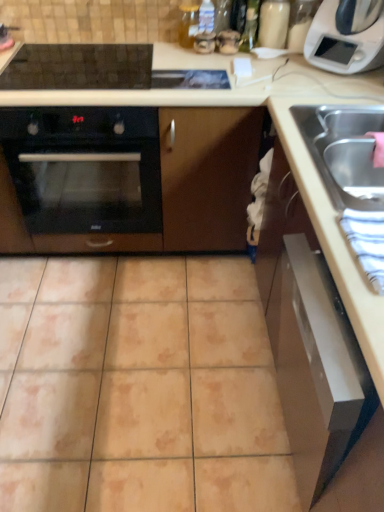
What do you see at coordinates (309, 339) in the screenshot? The width and height of the screenshot is (384, 512). I see `satin silver drawer at lower right` at bounding box center [309, 339].

Image resolution: width=384 pixels, height=512 pixels. I want to click on white plastic microwave at upper right, so click(344, 40).

Describe the element at coordinates (344, 152) in the screenshot. The width and height of the screenshot is (384, 512). I see `stainless steel sink at right` at that location.

Measure the distance between beige ceramic tile at center and camera.

A distance of 1.32 meters exists between beige ceramic tile at center and camera.

Describe the element at coordinates (87, 185) in the screenshot. Image resolution: width=384 pixels, height=512 pixels. I see `black glass oven at left` at that location.

Find the location of a particular element. Image resolution: width=384 pixels, height=512 pixels. satin silver drawer at lower right is located at coordinates (309, 339).

Which of these two, stainless steel sink at right or beige ceramic tile at center, stands shorter?

Standing shorter between the two is beige ceramic tile at center.

Looking at their sizes, would you say stainless steel sink at right is wider or thinner than beige ceramic tile at center?

Considering their sizes, stainless steel sink at right looks slimmer than beige ceramic tile at center.

Consider the image. Is stainless steel sink at right oriented towards beige ceramic tile at center?

No, stainless steel sink at right is not turned towards beige ceramic tile at center.

Measure the distance between stainless steel sink at right and beige ceramic tile at center.

The distance of stainless steel sink at right from beige ceramic tile at center is 38.70 inches.

From a real-world perspective, who is located lower, satin silver drawer at lower right or stainless steel sink at right?

satin silver drawer at lower right, from a real-world perspective.

Can you confirm if satin silver drawer at lower right is thinner than stainless steel sink at right?

In fact, satin silver drawer at lower right might be wider than stainless steel sink at right.

Would you say satin silver drawer at lower right contains stainless steel sink at right?

No, stainless steel sink at right is not a part of satin silver drawer at lower right.

Based on the photo, which is behind, white plastic microwave at upper right or stainless steel sink at right?

white plastic microwave at upper right.

Is stainless steel sink at right a part of white plastic microwave at upper right?

No, stainless steel sink at right is not surrounded by white plastic microwave at upper right.

Is white plastic microwave at upper right positioned with its back to stainless steel sink at right?

That's not correct — white plastic microwave at upper right is not looking away from stainless steel sink at right.

Which of these two, white plastic microwave at upper right or stainless steel sink at right, stands shorter?

Standing shorter between the two is stainless steel sink at right.

Are satin silver drawer at lower right and black glass oven at left far apart?

No, there isn't a large distance between satin silver drawer at lower right and black glass oven at left.

Identify the location of oven behind the satin silver drawer at lower right. The width and height of the screenshot is (384, 512). (87, 185).

From the image's perspective, is satin silver drawer at lower right over black glass oven at left?

No, from the image's perspective, satin silver drawer at lower right is not on top of black glass oven at left.

From a real-world perspective, between white plastic microwave at upper right and satin silver drawer at lower right, who is vertically higher?

white plastic microwave at upper right, from a real-world perspective.

Does point (336, 62) lie in front of point (323, 380)?

No, (336, 62) is behind (323, 380).

From the image's perspective, which one is positioned lower, white plastic microwave at upper right or satin silver drawer at lower right?

satin silver drawer at lower right appears lower in the image.

Considering the sizes of white plastic microwave at upper right and satin silver drawer at lower right in the image, is white plastic microwave at upper right taller or shorter than satin silver drawer at lower right?

Considering their sizes, white plastic microwave at upper right has less height than satin silver drawer at lower right.

Considering their positions, is black glass oven at left located in front of or behind satin silver drawer at lower right?

black glass oven at left is behind satin silver drawer at lower right.

Locate an element on the screen. This screenshot has width=384, height=512. cabinetry in front of the black glass oven at left is located at coordinates (309, 339).

Between black glass oven at left and satin silver drawer at lower right, which one has smaller size?

With smaller size is satin silver drawer at lower right.

Is point (125, 178) more distant than point (216, 457)?

Yes, it is.

How far apart are black glass oven at left and beige ceramic tile at center?

black glass oven at left is 21.96 inches from beige ceramic tile at center.

From the image's perspective, which object appears higher, black glass oven at left or beige ceramic tile at center?

black glass oven at left.

Who is more distant, black glass oven at left or beige ceramic tile at center?

Positioned behind is black glass oven at left.

At what (x,y) coordinates should I click in order to perform the action: click on sink to the right of beige ceramic tile at center. Please return your answer as a coordinate pair (x, y). The width and height of the screenshot is (384, 512). Looking at the image, I should click on (344, 152).

Find the location of a particular element. cabinetry below the stainless steel sink at right (from the image's perspective) is located at coordinates (309, 339).

Based on their spatial positions, is black glass oven at left or stainless steel sink at right closer to satin silver drawer at lower right?

Among the two, stainless steel sink at right is located nearer to satin silver drawer at lower right.

Estimate the real-world distances between objects in this image. Which object is closer to stainless steel sink at right, satin silver drawer at lower right or beige ceramic tile at center?

The object closer to stainless steel sink at right is satin silver drawer at lower right.

Based on their spatial positions, is stainless steel sink at right or satin silver drawer at lower right closer to white plastic microwave at upper right?

stainless steel sink at right lies closer to white plastic microwave at upper right than the other object.

Based on their spatial positions, is black glass oven at left or satin silver drawer at lower right further from beige ceramic tile at center?

Based on the image, black glass oven at left appears to be further to beige ceramic tile at center.

Looking at the image, which one is located further to white plastic microwave at upper right, beige ceramic tile at center or stainless steel sink at right?

beige ceramic tile at center is further to white plastic microwave at upper right.

Which object lies further to the anchor point white plastic microwave at upper right, satin silver drawer at lower right or beige ceramic tile at center?

beige ceramic tile at center is further to white plastic microwave at upper right.

From the image, which object appears to be farther from beige ceramic tile at center, white plastic microwave at upper right or satin silver drawer at lower right?

Among the two, white plastic microwave at upper right is located further to beige ceramic tile at center.

When comparing their distances from white plastic microwave at upper right, does satin silver drawer at lower right or black glass oven at left seem closer?

satin silver drawer at lower right.

This screenshot has height=512, width=384. I want to click on sink between black glass oven at left and white plastic microwave at upper right in the horizontal direction, so click(x=344, y=152).

This screenshot has height=512, width=384. In order to click on ceramic tile between black glass oven at left and satin silver drawer at lower right in this screenshot , I will do `click(138, 387)`.

The height and width of the screenshot is (512, 384). What are the coordinates of `oven that lies between white plastic microwave at upper right and satin silver drawer at lower right from top to bottom` in the screenshot? It's located at (87, 185).

Find the location of a particular element. cabinetry between beige ceramic tile at center and stainless steel sink at right is located at coordinates (309, 339).